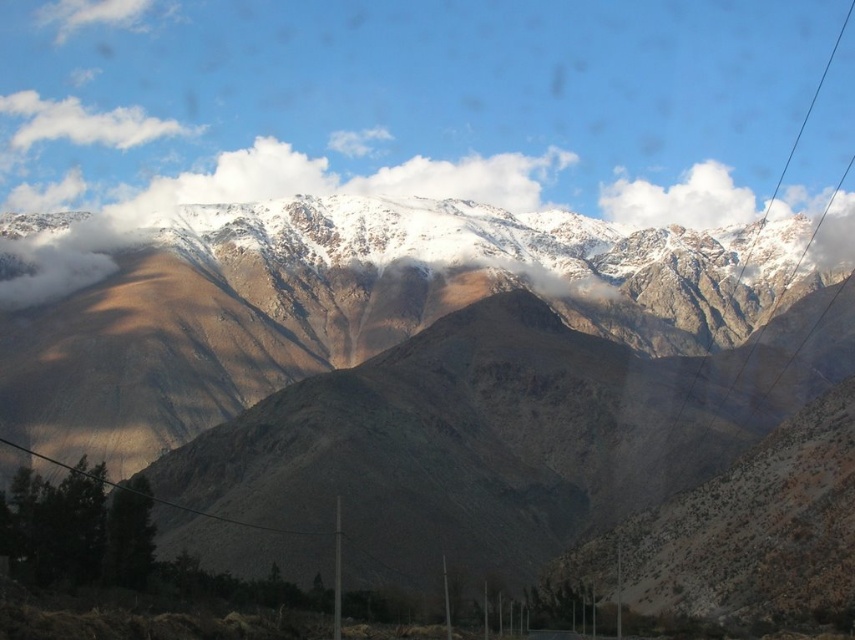
In the scene shown: You are a hiker looking at the mountain scene. You see the brown rocky mountain range at upper center and the white fluffy cloud at upper center. Which object is positioned to the left of the other?

The brown rocky mountain range at upper center is to the left of the white fluffy cloud at upper center.

You are standing at the base of the mountain looking up at the white fluffy cloud at upper center. If you have a telescope with a 500 meter range, can you see the cloud clearly through it?

The white fluffy cloud at upper center is 567.02 meters away from the viewer. Since the telescope has a 500 meter range, it cannot reach the required distance. Therefore, you cannot see the cloud clearly through the telescope.